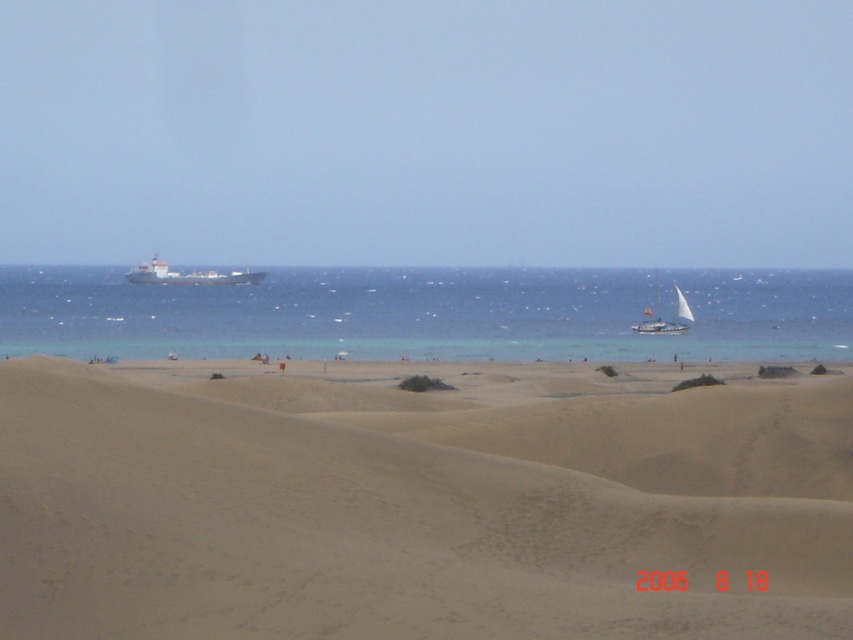
Question: Which point is closer to the camera?

Choices:
 (A) blue water at center
 (B) metallic gray ship at center-left

Answer: (A)

Question: Is metallic gray ship at center-left smaller than white sailboat at center?

Choices:
 (A) yes
 (B) no

Answer: (B)

Question: In this image, where is light brown sand at center located relative to white sailboat at center?

Choices:
 (A) left
 (B) right

Answer: (A)

Question: Is light brown sand at center closer to the viewer compared to metallic gray ship at center-left?

Choices:
 (A) yes
 (B) no

Answer: (A)

Question: Considering the real-world distances, which object is farthest from the white sailboat at center?

Choices:
 (A) metallic gray ship at center-left
 (B) blue water at center

Answer: (A)

Question: Which object is the farthest from the blue water at center?

Choices:
 (A) white sailboat at center
 (B) light brown sand at center

Answer: (B)